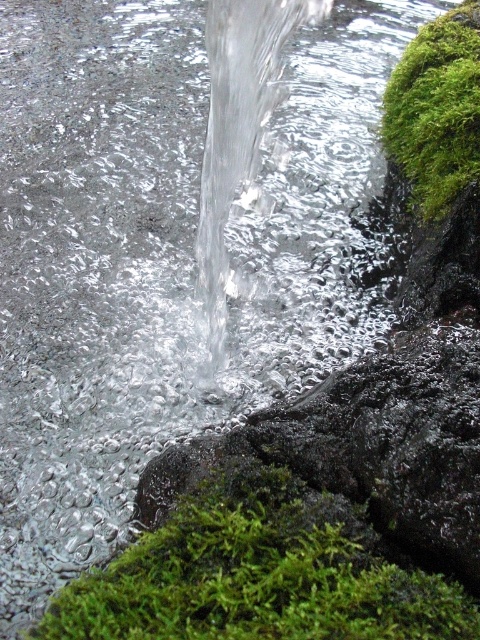
You are a botanist studying moss growth in a flowing water environment. You observe two patches of green fuzzy moss at lower center and green fuzzy moss at upper right. Which patch has a greater height?

The green fuzzy moss at upper right is taller than the green fuzzy moss at lower center.

Based on the photo, you are a hiker trying to cross the rocky area. You see two patches of green fuzzy moss at lower center and green fuzzy moss at upper right. Which moss patch is closer to the ground?

The green fuzzy moss at lower center is closer to the ground because it is located below the green fuzzy moss at upper right.

You are a botanist studying moss growth in a flowing water environment. You observe two patches of green fuzzy moss at lower center and green fuzzy moss at upper right. Which moss patch has a greater width?

The green fuzzy moss at lower center might be wider than green fuzzy moss at upper right.